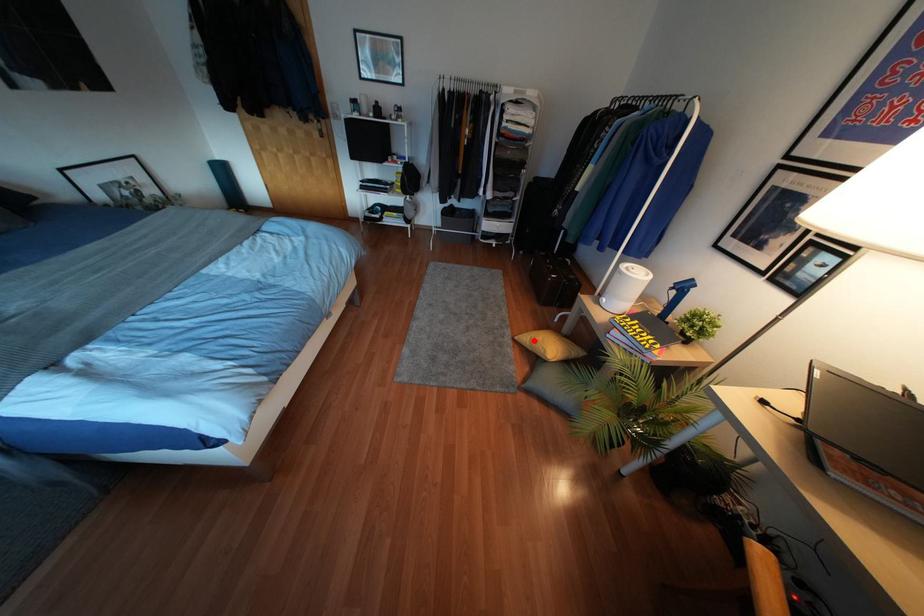
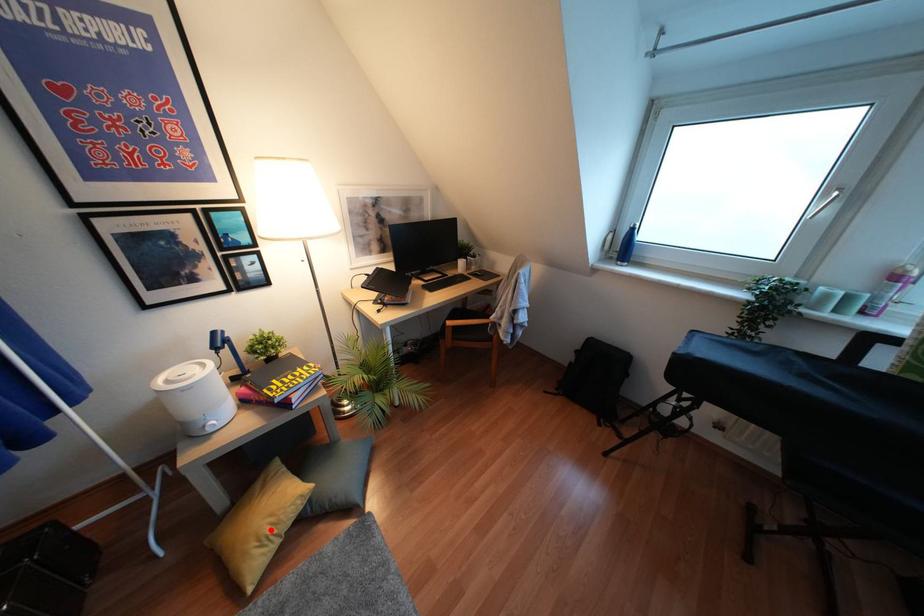
Based on the photo, I am providing you with two images of the same scene from different viewpoints. A red point is marked on the first image and another point is marked on the second image. Is the red point in image1 aligned with the point shown in image2?

Yes